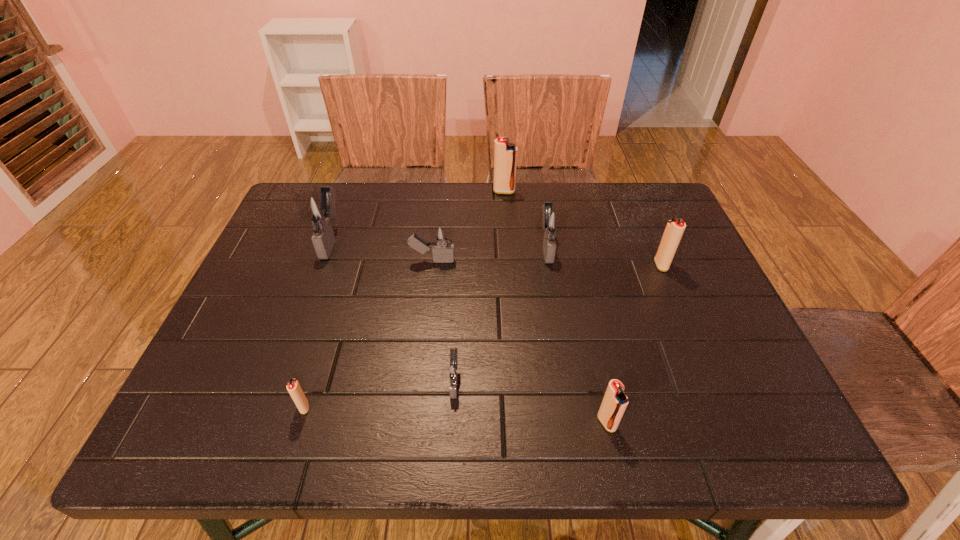
I want to click on the third biggest red igniter, so click(613, 406).

Find the location of `the smallest red igniter`. the smallest red igniter is located at coordinates (293, 387).

The height and width of the screenshot is (540, 960). I want to click on the second object from left to right, so click(x=293, y=387).

I want to click on the smallest gray igniter, so click(453, 370).

Locate an element on the screen. This screenshot has height=540, width=960. free location located on the front of the farthest igniter is located at coordinates (505, 207).

At what (x,y) coordinates should I click in order to perform the action: click on vacant space located 0.180m on the back of the leftmost object. Please return your answer as a coordinate pair (x, y). This screenshot has width=960, height=540. Looking at the image, I should click on (351, 185).

Identify the location of vacant area located 0.330m on the back of the rightmost object. (628, 187).

This screenshot has height=540, width=960. Identify the location of free space located on the front of the sixth object from left to right. (564, 352).

You are a GUI agent. You are given a task and a screenshot of the screen. Output one action in this format:
    pyautogui.click(x=<x>, y=<y>)
    Task: Click on the free space located on the left of the third biggest gray igniter
    
    Given the screenshot: What is the action you would take?
    pyautogui.click(x=360, y=260)

Where is `vacant space situated on the right of the seventh igniter from left to right`? This screenshot has width=960, height=540. vacant space situated on the right of the seventh igniter from left to right is located at coordinates (642, 422).